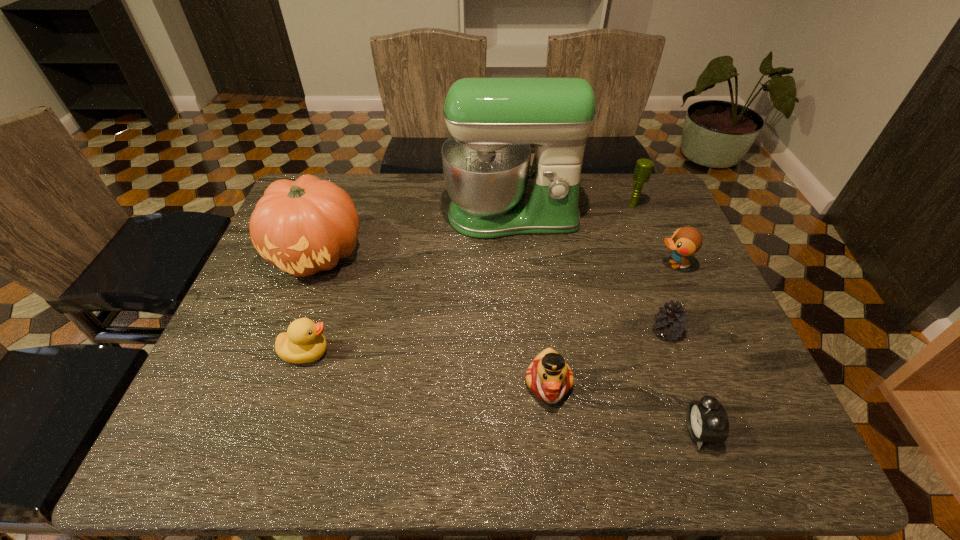
This screenshot has width=960, height=540. I want to click on free space in the image that satisfies the following two spatial constraints: 1. on the controls of the mixer; 2. on the right side of the pinecone, so click(521, 331).

In order to click on free space in the image that satisfies the following two spatial constraints: 1. on the controls of the mixer; 2. on the left side of the pinecone in this screenshot , I will do `click(521, 331)`.